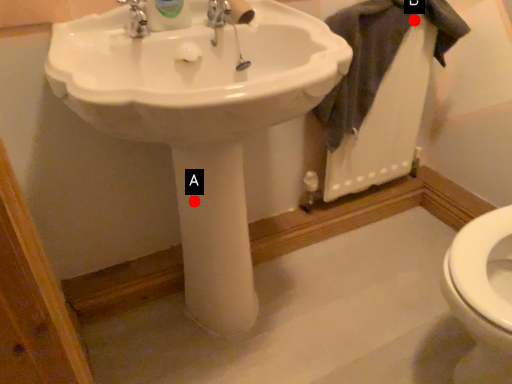
Question: Two points are circled on the image, labeled by A and B beside each circle. Which point is closer to the camera?

Choices:
 (A) A is closer
 (B) B is closer

Answer: (A)